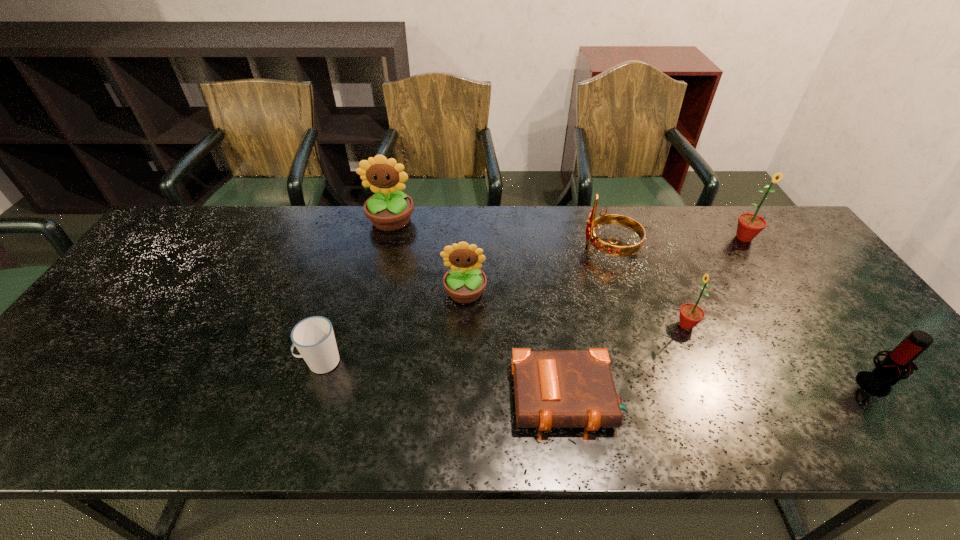
Where is `the bigger yellow sunflower`? Image resolution: width=960 pixels, height=540 pixels. the bigger yellow sunflower is located at coordinates (389, 209).

Find the location of `the leftmost sunflower`. the leftmost sunflower is located at coordinates (389, 209).

The height and width of the screenshot is (540, 960). Find the location of `the rightmost sunflower`. the rightmost sunflower is located at coordinates (749, 225).

Identify the location of the bigger green sunflower. The width and height of the screenshot is (960, 540). (749, 225).

The width and height of the screenshot is (960, 540). In order to click on tiara in this screenshot , I will do `click(610, 248)`.

The image size is (960, 540). What are the coordinates of `the third farthest sunflower` in the screenshot? It's located at (465, 281).

Find the location of a particular element. The image size is (960, 540). the smaller yellow sunflower is located at coordinates (465, 281).

Image resolution: width=960 pixels, height=540 pixels. What are the coordinates of `the fourth nearest object` in the screenshot? It's located at (690, 314).

Locate an element on the screen. The image size is (960, 540). the nearer green sunflower is located at coordinates (690, 314).

Locate an element on the screen. This screenshot has height=540, width=960. microphone is located at coordinates (890, 370).